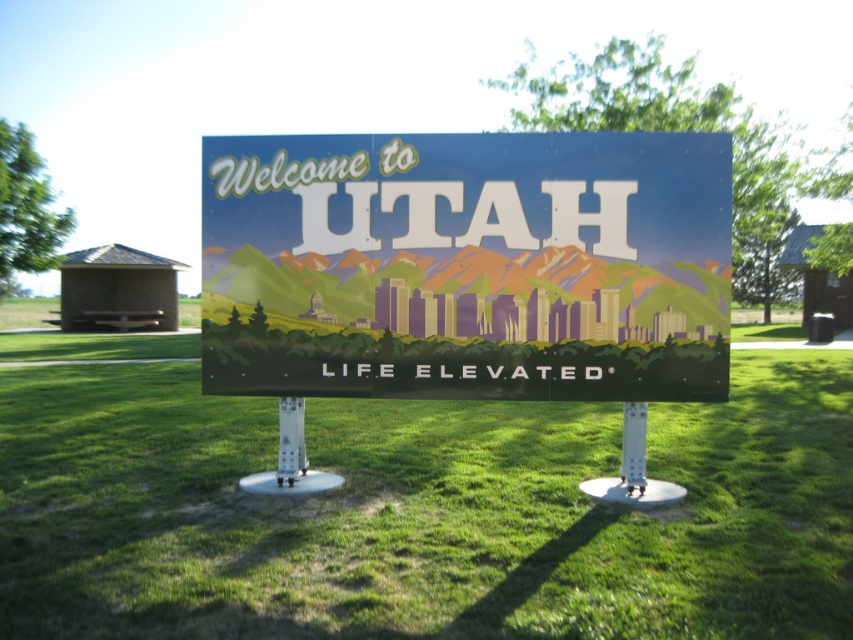
You are standing in front of the Welcome to UTAH sign and want to place a small flower pot exactly where the green grass at center is shown. What coordinates should you use to position it?

The coordinates for the green grass at center are at point [413,508], so you should place the flower pot there.

You are standing in front of the Welcome to UTAH sign and want to touch both the point at position (x=833, y=572) and the point at (x=207, y=388). Which point will require you to reach further out?

The point at (x=207, y=388) will require reaching further because it is farther from the camera compared to the point at (x=833, y=572).